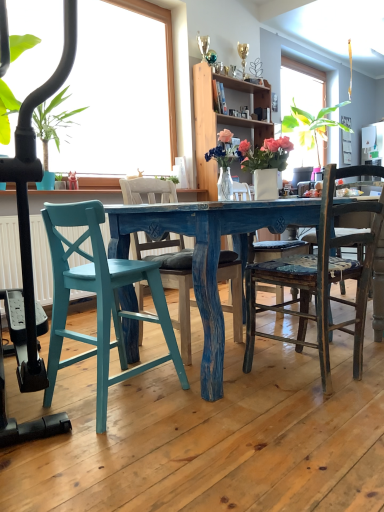
Image resolution: width=384 pixels, height=512 pixels. In order to click on distressed wood chair at center, which is the 1th chair in right-to-left order in this screenshot , I will do `click(320, 279)`.

At what (x,y) coordinates should I click in order to perform the action: click on wooden cabinet at upper center. Please return your answer as a coordinate pair (x, y). The width and height of the screenshot is (384, 512). Looking at the image, I should click on (224, 119).

What is the approximate height of wooden cabinet at upper center?

1.23 meters.

Where is `white glossy vase at center`? This screenshot has width=384, height=512. white glossy vase at center is located at coordinates (266, 154).

The image size is (384, 512). I want to click on teal painted wood chair at lower left, which appears as the first chair when viewed from the left, so click(x=99, y=300).

Is teal painted wood chair at lower left, which ranks as the third chair in right-to-left order, inside or outside of green leafy plant at left?

The correct answer is: outside.

Is point (98, 272) more distant than point (18, 44)?

No, it is not.

From a real-world perspective, is teal painted wood chair at lower left, which ranks as the third chair in right-to-left order, over green leafy plant at left?

No, from a real-world perspective, teal painted wood chair at lower left, which ranks as the third chair in right-to-left order, is not on top of green leafy plant at left.

Which is more to the right, green leafy plant at left or wooden cabinet at upper center?

wooden cabinet at upper center is more to the right.

Does green leafy plant at left lie behind wooden cabinet at upper center?

No, the depth of green leafy plant at left is less than that of wooden cabinet at upper center.

From a real-world perspective, between green leafy plant at left and wooden cabinet at upper center, who is vertically lower?

green leafy plant at left.

The height and width of the screenshot is (512, 384). There is a distressed wood chair at center, which is the 1th chair in right-to-left order. In order to click on houseplant above it (from a real-world perspective) in this screenshot , I will do `click(6, 111)`.

Considering the relative positions of distressed wood chair at center, which is the 3th chair in left-to-right order, and green leafy plant at left in the image provided, is distressed wood chair at center, which is the 3th chair in left-to-right order, to the left of green leafy plant at left from the viewer's perspective?

No.

Is distressed wood chair at center, which is the 1th chair in right-to-left order, positioned with its back to green leafy plant at left?

distressed wood chair at center, which is the 1th chair in right-to-left order, does not have its back to green leafy plant at left.

In terms of height, does distressed wood chair at center, which is the 3th chair in left-to-right order, look taller or shorter compared to green leafy plant at left?

Considering their sizes, distressed wood chair at center, which is the 3th chair in left-to-right order, has less height than green leafy plant at left.

Would you say green leafy plant at left is a long distance from teal painted wood chair at lower left, which ranks as the third chair in right-to-left order?

Yes, green leafy plant at left and teal painted wood chair at lower left, which ranks as the third chair in right-to-left order, are quite far apart.

Does green leafy plant at left have a lesser height compared to teal painted wood chair at lower left, which ranks as the third chair in right-to-left order?

No, green leafy plant at left is not shorter than teal painted wood chair at lower left, which ranks as the third chair in right-to-left order.

Is green leafy plant at left completely or partially outside of teal painted wood chair at lower left, which appears as the first chair when viewed from the left?

green leafy plant at left lies outside teal painted wood chair at lower left, which appears as the first chair when viewed from the left,'s area.

From a real-world perspective, relative to teal painted wood chair at lower left, which appears as the first chair when viewed from the left, is green leafy plant at left vertically above or below?

In terms of real-world spatial position, green leafy plant at left is above teal painted wood chair at lower left, which appears as the first chair when viewed from the left.

Is teal painted wood chair at lower left, which appears as the first chair when viewed from the left, not close to white glossy vase at center?

Yes, teal painted wood chair at lower left, which appears as the first chair when viewed from the left, and white glossy vase at center are quite far apart.

From the image's perspective, between teal painted wood chair at lower left, which ranks as the third chair in right-to-left order, and white glossy vase at center, which one is located above?

white glossy vase at center.

Can you tell me how much teal painted wood chair at lower left, which ranks as the third chair in right-to-left order, and white glossy vase at center differ in facing direction?

52.8 degrees.

Who is more distant, blue painted wood chair at center, the 2th chair viewed from the right, or distressed wood chair at center, which is the 1th chair in right-to-left order?

blue painted wood chair at center, the 2th chair viewed from the right, is behind.

Does point (219, 277) come farther from viewer compared to point (295, 258)?

No, (219, 277) is closer to viewer.

Based on the photo, from the image's perspective, relative to distressed wood chair at center, which is the 3th chair in left-to-right order, is blue painted wood chair at center, positioned as the 2th chair in left-to-right order, above or below?

From the image's perspective, blue painted wood chair at center, positioned as the 2th chair in left-to-right order, appears above distressed wood chair at center, which is the 3th chair in left-to-right order.

In the scene shown: Is blue painted wood chair at center, the 2th chair viewed from the right, facing away from distressed wood chair at center, which is the 1th chair in right-to-left order?

blue painted wood chair at center, the 2th chair viewed from the right, does not have its back to distressed wood chair at center, which is the 1th chair in right-to-left order.

Identify the location of houseplant that appears on the left of white glossy vase at center. (6, 111).

Considering the sizes of white glossy vase at center and green leafy plant at left in the image, is white glossy vase at center wider or thinner than green leafy plant at left?

white glossy vase at center is thinner than green leafy plant at left.

In the scene shown: Is white glossy vase at center facing away from green leafy plant at left?

Yes, green leafy plant at left is at the back of white glossy vase at center.

Are white glossy vase at center and green leafy plant at left making contact?

No, white glossy vase at center is not in contact with green leafy plant at left.

You are a GUI agent. You are given a task and a screenshot of the screen. Output one action in this format:
    pyautogui.click(x=<x>, y=<y>)
    Task: Click on the houseplant located above the teal painted wood chair at lower left, which appears as the first chair when viewed from the left (from the image's perspective)
    
    Given the screenshot: What is the action you would take?
    pyautogui.click(x=6, y=111)

You are a GUI agent. You are given a task and a screenshot of the screen. Output one action in this format:
    pyautogui.click(x=<x>, y=<y>)
    Task: Click on the cabinetry on the right of the green leafy plant at left
    The height and width of the screenshot is (512, 384).
    Given the screenshot: What is the action you would take?
    pyautogui.click(x=224, y=119)

Looking at the image, which one is located closer to teal painted wood chair at lower left, which ranks as the third chair in right-to-left order, distressed wood chair at center, which is the 3th chair in left-to-right order, or green leafy plant at left?

Among the two, distressed wood chair at center, which is the 3th chair in left-to-right order, is located nearer to teal painted wood chair at lower left, which ranks as the third chair in right-to-left order.

Looking at the image, which one is located closer to blue painted wood chair at center, positioned as the 2th chair in left-to-right order, teal painted wood chair at lower left, which ranks as the third chair in right-to-left order, or wooden cabinet at upper center?

teal painted wood chair at lower left, which ranks as the third chair in right-to-left order, lies closer to blue painted wood chair at center, positioned as the 2th chair in left-to-right order, than the other object.

Estimate the real-world distances between objects in this image. Which object is further from distressed wood chair at center, which is the 3th chair in left-to-right order, white glossy vase at center or teal painted wood chair at lower left, which ranks as the third chair in right-to-left order?

white glossy vase at center is further to distressed wood chair at center, which is the 3th chair in left-to-right order.

In the scene shown: Which object lies further to the anchor point wooden cabinet at upper center, white glossy vase at center or green leafy plant at left?

white glossy vase at center is positioned further to the anchor wooden cabinet at upper center.

When comparing their distances from teal painted wood chair at lower left, which ranks as the third chair in right-to-left order, does green leafy plant at left or distressed wood chair at center, which is the 3th chair in left-to-right order, seem closer?

distressed wood chair at center, which is the 3th chair in left-to-right order, lies closer to teal painted wood chair at lower left, which ranks as the third chair in right-to-left order, than the other object.

Considering their positions, is distressed wood chair at center, which is the 3th chair in left-to-right order, positioned closer to green leafy plant at left than wooden cabinet at upper center?

wooden cabinet at upper center is positioned closer to the anchor green leafy plant at left.

Which object lies further to the anchor point teal painted wood chair at lower left, which ranks as the third chair in right-to-left order, wooden cabinet at upper center or white glossy vase at center?

Based on the image, wooden cabinet at upper center appears to be further to teal painted wood chair at lower left, which ranks as the third chair in right-to-left order.

Estimate the real-world distances between objects in this image. Which object is closer to wooden cabinet at upper center, blue painted wood chair at center, positioned as the 2th chair in left-to-right order, or distressed wood chair at center, which is the 1th chair in right-to-left order?

Among the two, blue painted wood chair at center, positioned as the 2th chair in left-to-right order, is located nearer to wooden cabinet at upper center.

The image size is (384, 512). I want to click on houseplant between blue painted wood chair at center, the 2th chair viewed from the right, and wooden cabinet at upper center in the front-back direction, so click(x=6, y=111).

The height and width of the screenshot is (512, 384). Find the location of `floral arrangement positioned between teal painted wood chair at lower left, which ranks as the third chair in right-to-left order, and wooden cabinet at upper center from near to far`. floral arrangement positioned between teal painted wood chair at lower left, which ranks as the third chair in right-to-left order, and wooden cabinet at upper center from near to far is located at coordinates (266, 154).

The height and width of the screenshot is (512, 384). Identify the location of floral arrangement between green leafy plant at left and distressed wood chair at center, which is the 3th chair in left-to-right order. (266, 154).

Locate an element on the screen. The width and height of the screenshot is (384, 512). floral arrangement between distressed wood chair at center, which is the 1th chair in right-to-left order, and wooden cabinet at upper center, along the z-axis is located at coordinates (266, 154).